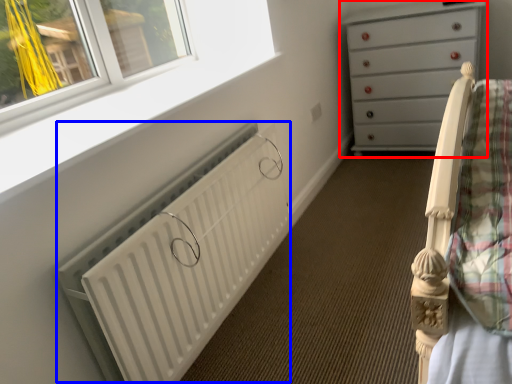
Question: Which of the following is the closest to the observer, chest of drawers (highlighted by a red box) or radiator (highlighted by a blue box)?

Choices:
 (A) chest of drawers
 (B) radiator

Answer: (B)